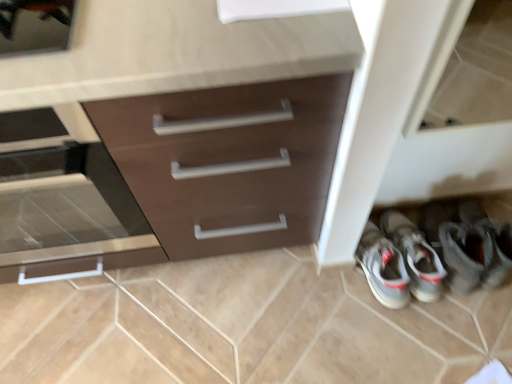
Question: Is brown matte cabinet at center in front of or behind gray fabric sneakers at lower right in the image?

Choices:
 (A) behind
 (B) front

Answer: (B)

Question: In terms of size, does brown matte cabinet at center appear bigger or smaller than gray fabric sneakers at lower right?

Choices:
 (A) big
 (B) small

Answer: (A)

Question: Which is nearer to the gray fabric sneakers at lower right?

Choices:
 (A) brown matte cabinet at center
 (B) matte brown drawer at left

Answer: (A)

Question: Which is farther from the gray fabric sneakers at lower right?

Choices:
 (A) matte brown drawer at left
 (B) brown matte cabinet at center

Answer: (A)